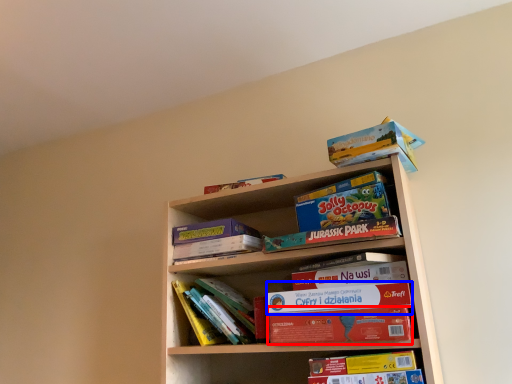
Question: Among these objects, which one is nearest to the camera, paperback book (highlighted by a red box) or paperback book (highlighted by a blue box)?

Choices:
 (A) paperback book
 (B) paperback book

Answer: (A)